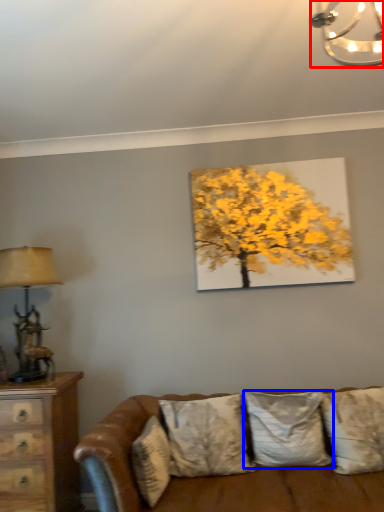
Question: Which of the following is the farthest to the observer, lamp (highlighted by a red box) or pillow (highlighted by a blue box)?

Choices:
 (A) lamp
 (B) pillow

Answer: (B)